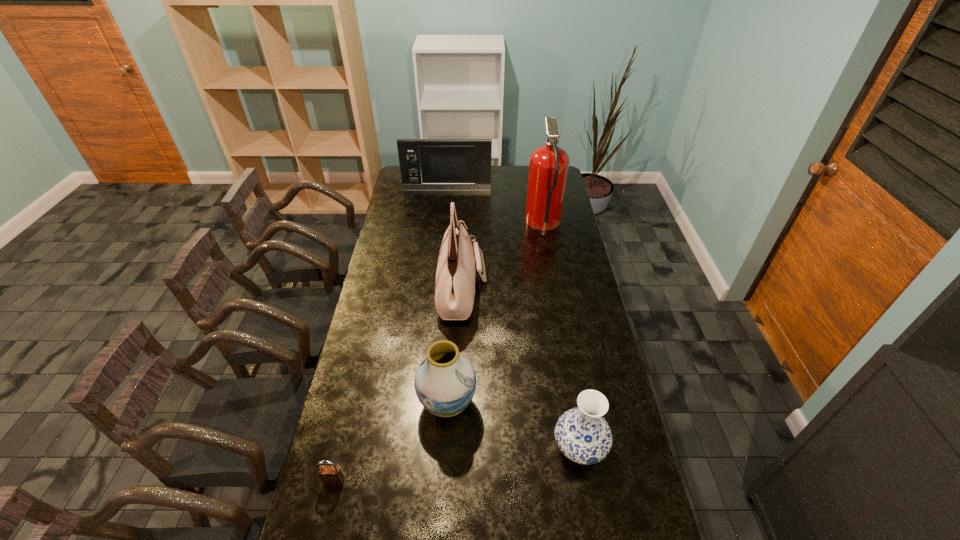
The image size is (960, 540). Find the location of `empty space between the right vase and the nearest object`. empty space between the right vase and the nearest object is located at coordinates (457, 464).

Select which object is the second closest to the farthest object. Please provide its 2D coordinates. Your answer should be formatted as a tuple, i.e. [(x, y)], where the tuple contains the x and y coordinates of a point satisfying the conditions above.

[(455, 276)]

Image resolution: width=960 pixels, height=540 pixels. Find the location of `object that is the fifth closest to the right vase`. object that is the fifth closest to the right vase is located at coordinates (426, 164).

Identify the location of vacant space that satisfies the following two spatial constraints: 1. with the handle and nozzle on the fire extinguisher; 2. on the front-facing side of the shortest object. (589, 480).

This screenshot has height=540, width=960. Find the location of `free location that satisfies the following two spatial constraints: 1. on the side of the handbag with the attached pouch; 2. on the left side of the right vase`. free location that satisfies the following two spatial constraints: 1. on the side of the handbag with the attached pouch; 2. on the left side of the right vase is located at coordinates (456, 448).

The image size is (960, 540). I want to click on vacant position in the image that satisfies the following two spatial constraints: 1. on the front panel of the left vase; 2. on the left side of the microwave oven, so click(x=425, y=403).

Locate an element on the screen. This screenshot has height=540, width=960. free space that satisfies the following two spatial constraints: 1. with the handle and nozzle on the fire extinguisher; 2. on the front side of the left vase is located at coordinates (575, 403).

What are the coordinates of `free spot that satisfies the following two spatial constraints: 1. on the front panel of the microwave oven; 2. on the left side of the left vase` in the screenshot? It's located at (425, 403).

Where is `blank area in the image that satisfies the following two spatial constraints: 1. with the handle and nozzle on the fire extinguisher; 2. on the front-facing side of the nearest object`? The height and width of the screenshot is (540, 960). blank area in the image that satisfies the following two spatial constraints: 1. with the handle and nozzle on the fire extinguisher; 2. on the front-facing side of the nearest object is located at coordinates (589, 480).

Find the location of a particular element. The width and height of the screenshot is (960, 540). vacant region that satisfies the following two spatial constraints: 1. on the side of the fourth nearest object with the attached pouch; 2. on the back side of the right vase is located at coordinates (456, 448).